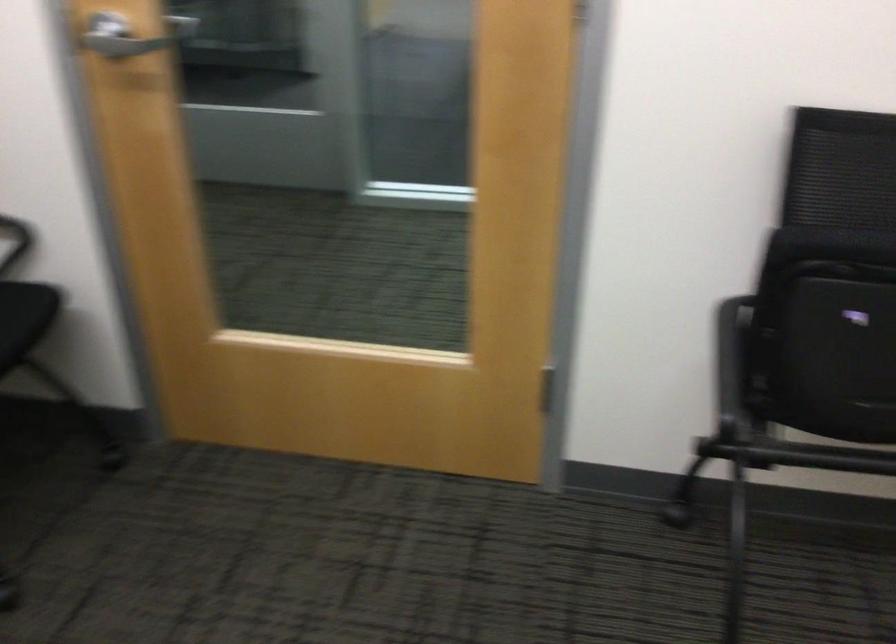
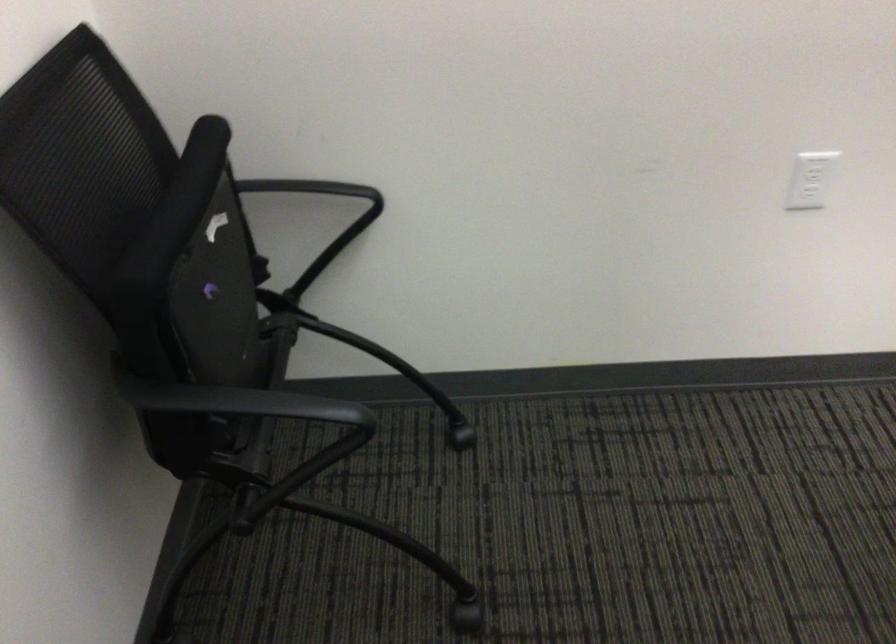
Where in the second image is the point corresponding to point (824, 449) from the first image?

(254, 420)